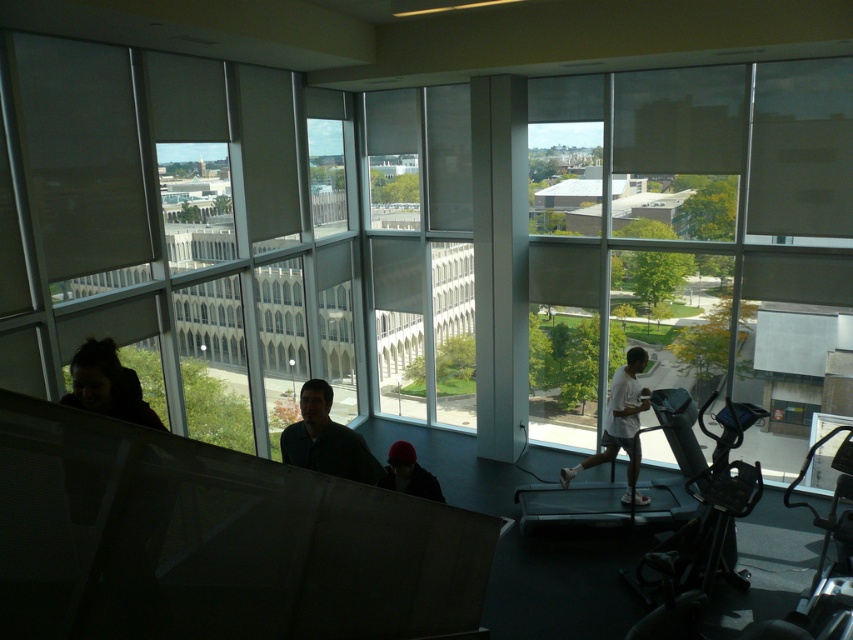
Question: Does matte black hair at left have a larger size compared to dark blue knit cap at center?

Choices:
 (A) yes
 (B) no

Answer: (A)

Question: Which object is the closest to the dark blue knit cap at center?

Choices:
 (A) dark blue shirt at center
 (B) matte black hair at left
 (C) white matte shirt at center

Answer: (A)

Question: Does dark blue shirt at center lie in front of white matte shirt at center?

Choices:
 (A) no
 (B) yes

Answer: (B)

Question: Which object appears closest to the camera in this image?

Choices:
 (A) white matte shirt at center
 (B) dark blue shirt at center

Answer: (B)

Question: Can you confirm if dark blue shirt at center is bigger than dark blue knit cap at center?

Choices:
 (A) yes
 (B) no

Answer: (A)

Question: Which of the following is the closest to the observer?

Choices:
 (A) matte black hair at left
 (B) dark blue shirt at center

Answer: (A)